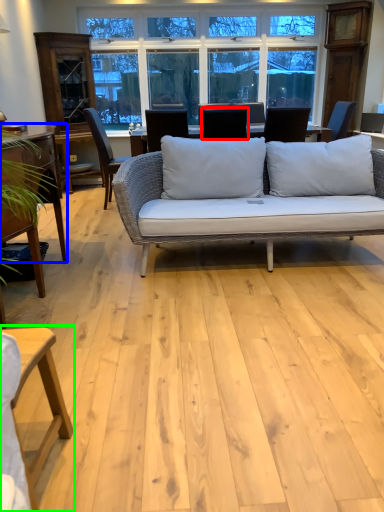
Question: Which is farther away from chair (highlighted by a red box)? table (highlighted by a blue box) or table (highlighted by a green box)?

Choices:
 (A) table
 (B) table

Answer: (B)